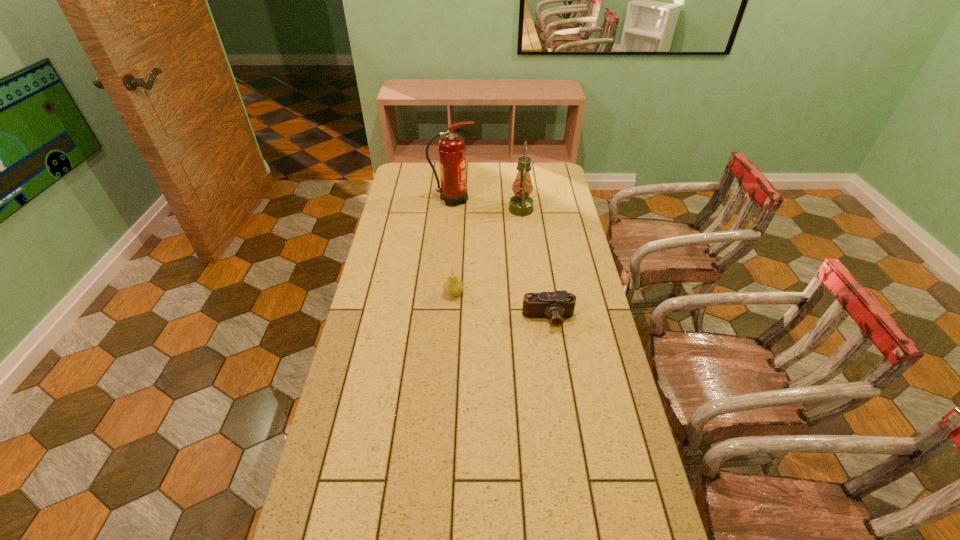
Locate an element on the screen. object present at the right edge is located at coordinates (556, 305).

Identify the location of vacant area at the left edge. (342, 374).

In the image, there is a desktop. Identify the location of vacant area at the right edge. (567, 191).

Find the location of a particular element. free space at the far left corner of the desktop is located at coordinates (424, 174).

The height and width of the screenshot is (540, 960). I want to click on free space at the far right corner, so click(x=532, y=177).

Where is `free space that is in between the fire extinguisher and the camera`? The height and width of the screenshot is (540, 960). free space that is in between the fire extinguisher and the camera is located at coordinates (500, 259).

This screenshot has width=960, height=540. I want to click on blank region between the nearest object and the second tallest object, so (x=535, y=264).

Find the location of a particular element. empty space that is in between the fire extinguisher and the shortest object is located at coordinates (500, 259).

Image resolution: width=960 pixels, height=540 pixels. I want to click on vacant space that's between the camera and the fire extinguisher, so [x=500, y=259].

Where is `empty space that is in between the oil lamp and the third tallest object`? The width and height of the screenshot is (960, 540). empty space that is in between the oil lamp and the third tallest object is located at coordinates (488, 252).